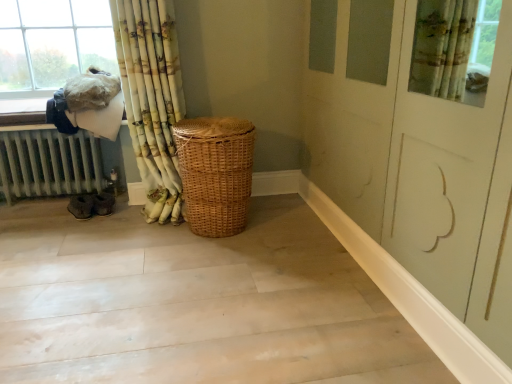
In order to click on vacant space in front of white painted metal radiator at left in this screenshot , I will do `click(57, 244)`.